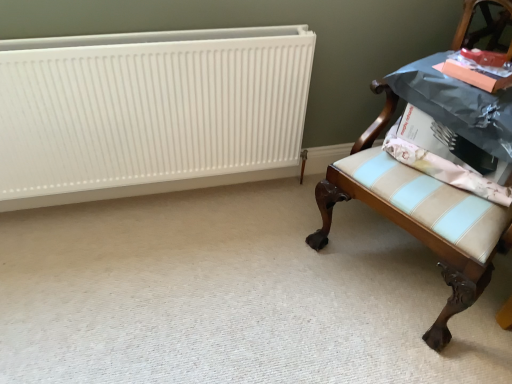
Identify the location of wooden upholstered chair at right. (421, 241).

This screenshot has height=384, width=512. Find the location of `light blue striped fabric at right`. light blue striped fabric at right is located at coordinates (445, 170).

This screenshot has height=384, width=512. I want to click on wooden upholstered chair at right, so click(x=421, y=241).

In the image, is wooden upholstered chair at right on the left side or the right side of light blue striped fabric at right?

wooden upholstered chair at right is to the left of light blue striped fabric at right.

Is wooden upholstered chair at right closer to the viewer compared to light blue striped fabric at right?

Yes, wooden upholstered chair at right is closer to the viewer.

Locate an element on the screen. chair located below the light blue striped fabric at right (from the image's perspective) is located at coordinates (421, 241).

Can you confirm if white matte radiator at upper left is positioned to the right of wooden upholstered chair at right?

In fact, white matte radiator at upper left is to the left of wooden upholstered chair at right.

From the image's perspective, does white matte radiator at upper left appear lower than wooden upholstered chair at right?

Incorrect, from the image's perspective, white matte radiator at upper left is higher than wooden upholstered chair at right.

Is white matte radiator at upper left not close to wooden upholstered chair at right?

No, there isn't a large distance between white matte radiator at upper left and wooden upholstered chair at right.

Is white matte radiator at upper left to the left or to the right of light blue striped fabric at right in the image?

From the image, it's evident that white matte radiator at upper left is to the left of light blue striped fabric at right.

Are white matte radiator at upper left and light blue striped fabric at right located far from each other?

No, white matte radiator at upper left is not far away from light blue striped fabric at right.

From a real-world perspective, is white matte radiator at upper left positioned above or below light blue striped fabric at right?

Clearly, from a real-world perspective, white matte radiator at upper left is below light blue striped fabric at right.

Considering the sizes of light blue striped fabric at right and white matte radiator at upper left in the image, is light blue striped fabric at right bigger or smaller than white matte radiator at upper left?

Considering their sizes, light blue striped fabric at right takes up less space than white matte radiator at upper left.

Can you tell me how much light blue striped fabric at right and white matte radiator at upper left differ in facing direction?

The angular difference between light blue striped fabric at right and white matte radiator at upper left is 51.2 degrees.

Is light blue striped fabric at right facing away from white matte radiator at upper left?

No, light blue striped fabric at right is not facing away from white matte radiator at upper left.

From a real-world perspective, is light blue striped fabric at right physically located above or below white matte radiator at upper left?

From a real-world perspective, light blue striped fabric at right is physically above white matte radiator at upper left.

Is light blue striped fabric at right closer to the viewer compared to wooden upholstered chair at right?

No, light blue striped fabric at right is further to the viewer.

Locate an element on the screen. fabric behind the wooden upholstered chair at right is located at coordinates (445, 170).

From the image's perspective, which one is positioned higher, light blue striped fabric at right or wooden upholstered chair at right?

From the image's view, light blue striped fabric at right is above.

In terms of size, does light blue striped fabric at right appear bigger or smaller than wooden upholstered chair at right?

light blue striped fabric at right is smaller than wooden upholstered chair at right.

Is wooden upholstered chair at right positioned in front of white matte radiator at upper left?

Yes.

How different are the orientations of wooden upholstered chair at right and white matte radiator at upper left in degrees?

59.7 degrees separate the facing orientations of wooden upholstered chair at right and white matte radiator at upper left.

Considering the relative sizes of wooden upholstered chair at right and white matte radiator at upper left in the image provided, is wooden upholstered chair at right taller than white matte radiator at upper left?

Correct, wooden upholstered chair at right is much taller as white matte radiator at upper left.

Would you say wooden upholstered chair at right is a long distance from white matte radiator at upper left?

Actually, wooden upholstered chair at right and white matte radiator at upper left are a little close together.

In the image, there is a light blue striped fabric at right. Where is `chair below it (from a real-world perspective)`? chair below it (from a real-world perspective) is located at coordinates (421, 241).

The width and height of the screenshot is (512, 384). I want to click on chair below the white matte radiator at upper left (from the image's perspective), so click(421, 241).

Estimate the real-world distances between objects in this image. Which object is further from wooden upholstered chair at right, light blue striped fabric at right or white matte radiator at upper left?

white matte radiator at upper left lies further to wooden upholstered chair at right than the other object.

When comparing their distances from white matte radiator at upper left, does wooden upholstered chair at right or light blue striped fabric at right seem closer?

Among the two, wooden upholstered chair at right is located nearer to white matte radiator at upper left.

Which object lies nearer to the anchor point wooden upholstered chair at right, white matte radiator at upper left or light blue striped fabric at right?

light blue striped fabric at right is closer to wooden upholstered chair at right.

From the image, which object appears to be nearer to light blue striped fabric at right, white matte radiator at upper left or wooden upholstered chair at right?

The object closer to light blue striped fabric at right is wooden upholstered chair at right.

In the scene shown: Based on their spatial positions, is light blue striped fabric at right or wooden upholstered chair at right further from white matte radiator at upper left?

light blue striped fabric at right.

Considering their positions, is wooden upholstered chair at right positioned further to light blue striped fabric at right than white matte radiator at upper left?

white matte radiator at upper left is positioned further to the anchor light blue striped fabric at right.

This screenshot has height=384, width=512. I want to click on chair between white matte radiator at upper left and light blue striped fabric at right, so click(x=421, y=241).